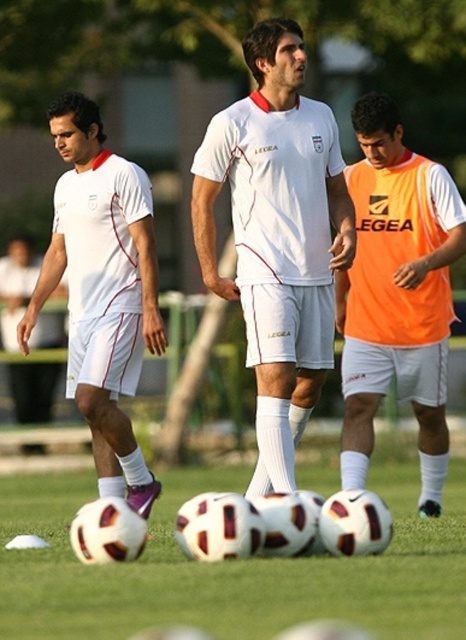
You are a soccer coach observing the training session. You notice the white matte soccer balls at center and the white matte jersey at center. Which object is positioned lower in the image?

The white matte soccer balls at center are positioned lower than the white matte jersey at center.

You are a soccer coach observing the training session. You notice the white matte jersey at center and the orange mesh vest at center. Which piece of clothing is wider?

The white matte jersey at center is wider than the orange mesh vest at center, as its width surpasses that of the orange mesh vest at center.

You are a soccer coach observing the training session. You notice a point at coordinates (228, 568) on the image. What object is located at that point?

The point at coordinates (228, 568) is on the white matte soccer balls at center.